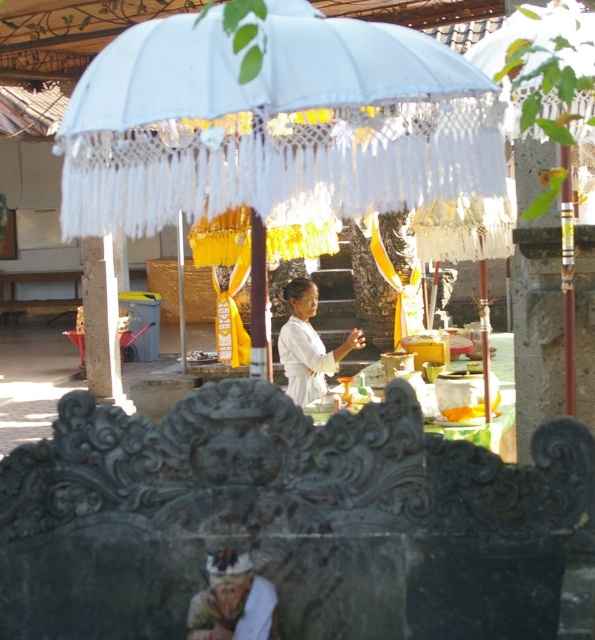
Question: Is white lace umbrella at center positioned in front of white matte/soft fabric woman at center?

Choices:
 (A) yes
 (B) no

Answer: (A)

Question: Considering the relative positions of white lace umbrella at center and white matte/soft fabric woman at center in the image provided, where is white lace umbrella at center located with respect to white matte/soft fabric woman at center?

Choices:
 (A) left
 (B) right

Answer: (A)

Question: Where is white lace umbrella at center located in relation to white matte/soft fabric woman at center in the image?

Choices:
 (A) right
 (B) left

Answer: (B)